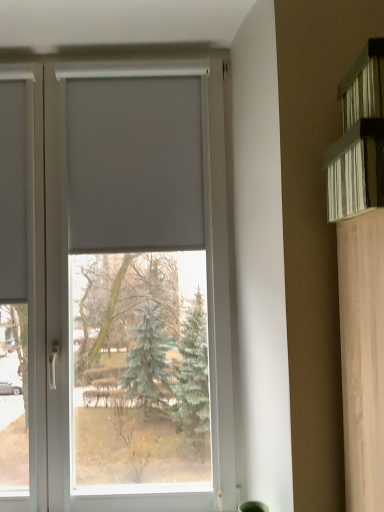
Question: Considering the positions of white matte blind at center and white matte window at center in the image, is white matte blind at center taller or shorter than white matte window at center?

Choices:
 (A) tall
 (B) short

Answer: (B)

Question: Is white matte blind at center in front of or behind white matte window at center in the image?

Choices:
 (A) front
 (B) behind

Answer: (B)

Question: Which object is positioned closest to the white textured shelf at upper right?

Choices:
 (A) white matte window at center
 (B) white matte blind at center

Answer: (B)

Question: Which of these objects is positioned closest to the white textured shelf at upper right?

Choices:
 (A) white matte blind at center
 (B) white matte window at center

Answer: (A)